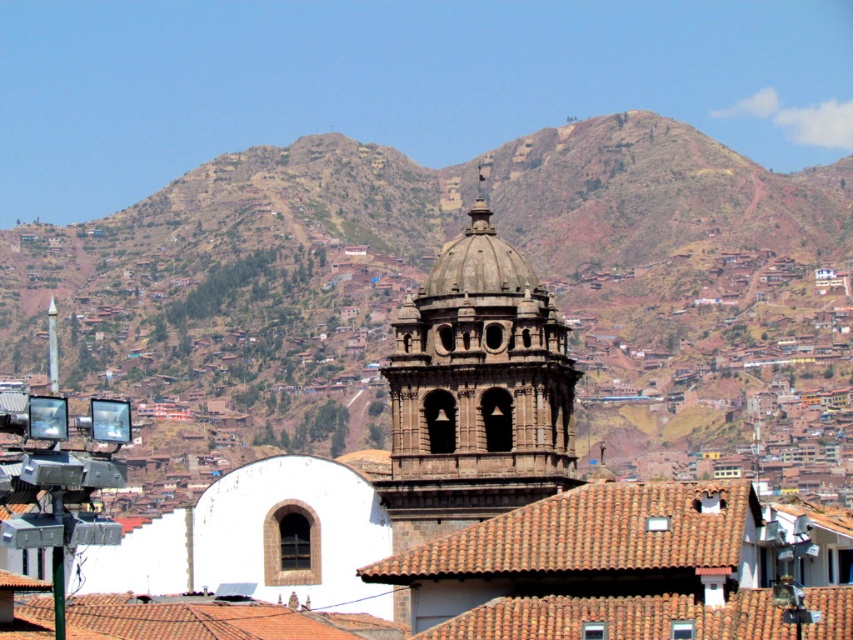
Question: Is brown rocky mountain at upper center smaller than dark brown stone tower at center?

Choices:
 (A) no
 (B) yes

Answer: (A)

Question: Which of the following is the farthest from the observer?

Choices:
 (A) brown rocky mountain at upper center
 (B) dark brown stone tower at center

Answer: (A)

Question: Is brown rocky mountain at upper center bigger than dark brown stone tower at center?

Choices:
 (A) yes
 (B) no

Answer: (A)

Question: Which point is farther to the camera?

Choices:
 (A) dark brown stone tower at center
 (B) brown rocky mountain at upper center

Answer: (B)

Question: Is brown rocky mountain at upper center to the left of dark brown stone tower at center from the viewer's perspective?

Choices:
 (A) no
 (B) yes

Answer: (B)